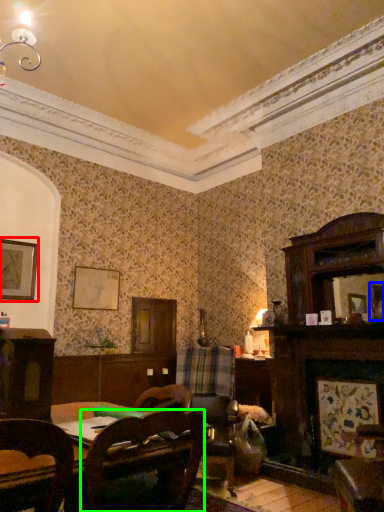
Question: Which is nearer to the picture frame (highlighted by a red box)? picture frame (highlighted by a blue box) or chair (highlighted by a green box).

Choices:
 (A) picture frame
 (B) chair

Answer: (B)